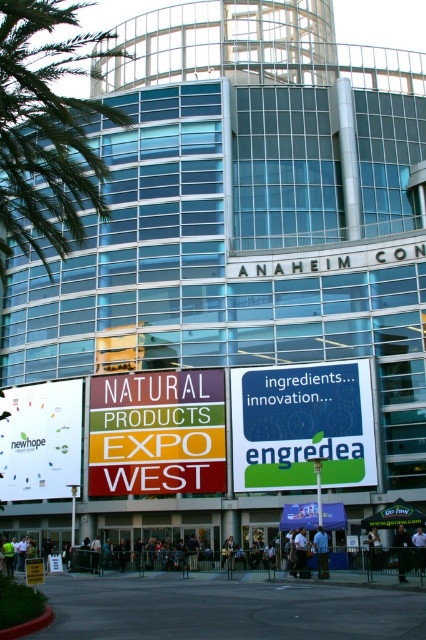
You are attending the Natural Products Expo West at the Anaheim Convention Center. You notice a white paper billboard at lower left and a denim jacket at lower center. Which object is wider?

The white paper billboard at lower left is wider than the denim jacket at lower center.

You are standing in front of the Anaheim Convention Center and see the white paper billboard at lower left and the denim jacket at lower center. Which object is located to the left of the other?

The white paper billboard at lower left is positioned on the left side of denim jacket at lower center.